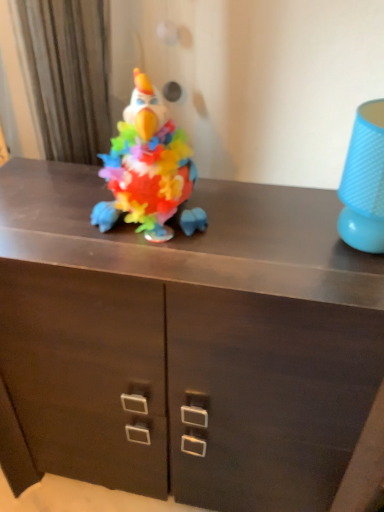
Where is `free space above wooden cabinet at center (from a real-world perspective)`? The image size is (384, 512). free space above wooden cabinet at center (from a real-world perspective) is located at coordinates (199, 224).